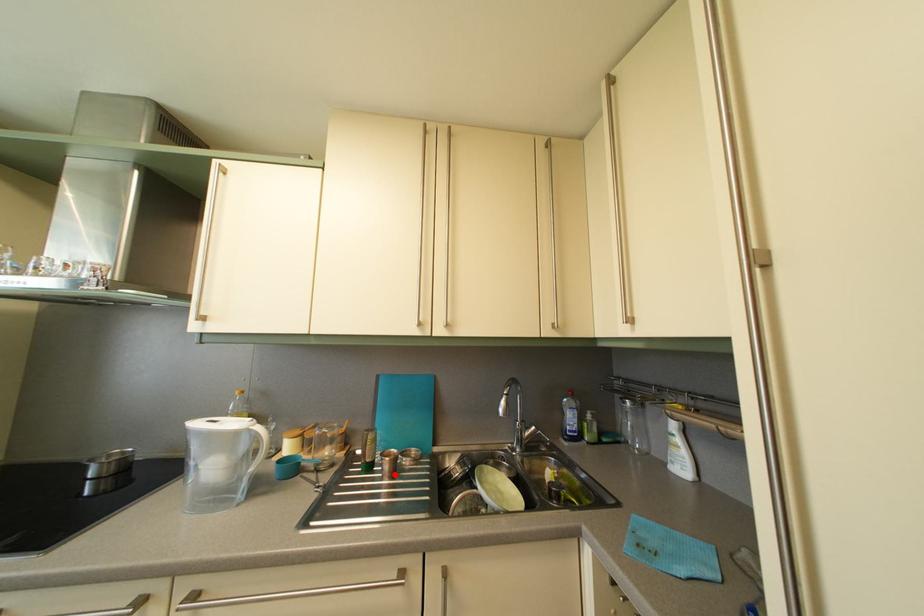
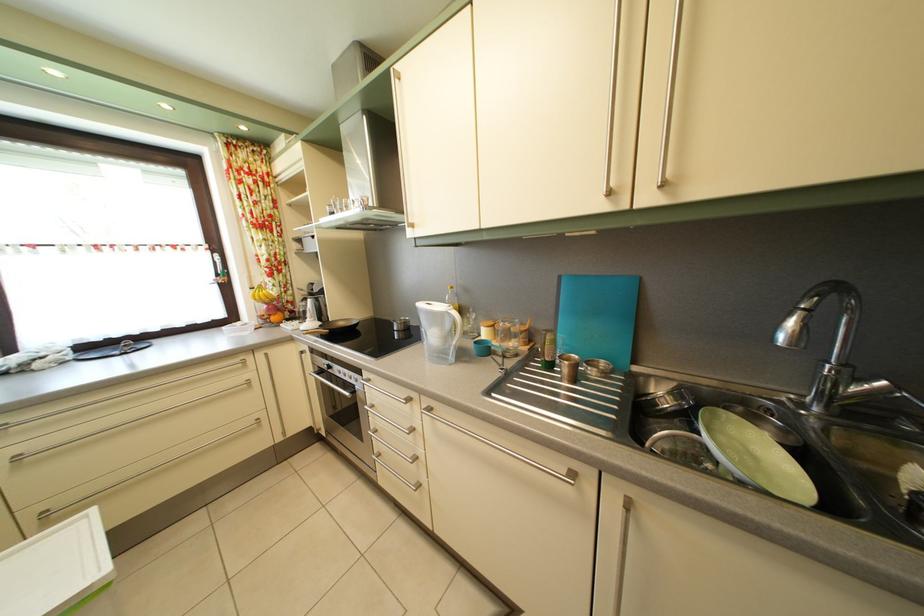
Where in the second image is the point corresponding to the highlighted location from the first image?

(574, 378)